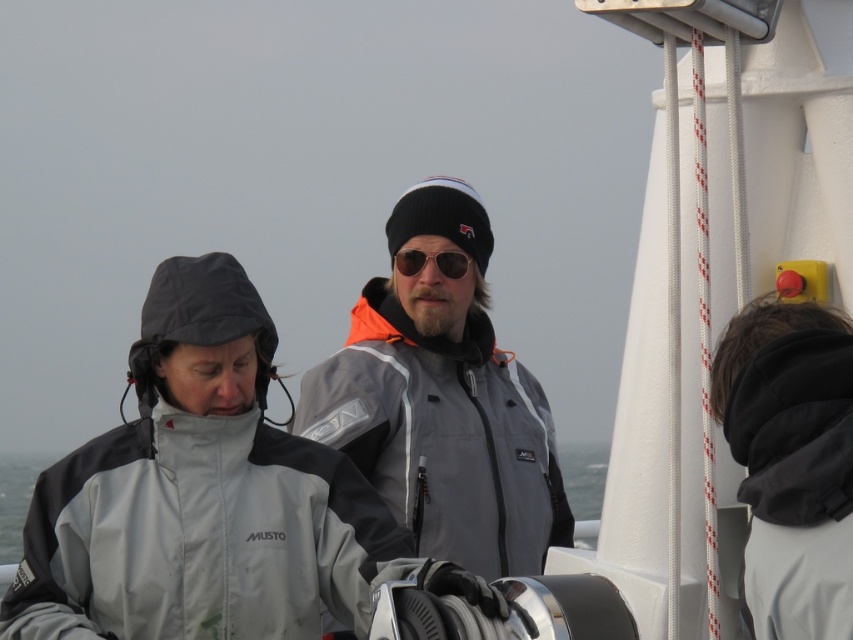
Between gray softshell jacket at center and black fleece jacket at right, which one has more height?

gray softshell jacket at center

Does gray softshell jacket at center have a greater width compared to black fleece jacket at right?

Correct, the width of gray softshell jacket at center exceeds that of black fleece jacket at right.

Which is behind, point (374, 467) or point (782, 321)?

The point (374, 467) is behind.

In order to click on gray softshell jacket at center in this screenshot , I will do `click(206, 492)`.

Is point (409, 346) in front of point (799, 308)?

That is False.

Is point (489, 557) positioned after point (746, 396)?

Yes, point (489, 557) is behind point (746, 396).

This screenshot has height=640, width=853. I want to click on gray matte jacket at center, so click(x=442, y=401).

Can you confirm if gray softshell jacket at center is smaller than gray fabric water at center?

Correct, gray softshell jacket at center occupies less space than gray fabric water at center.

Which is in front, point (387, 531) or point (9, 467)?

Point (387, 531)

Locate an element on the screen. The image size is (853, 640). gray softshell jacket at center is located at coordinates (206, 492).